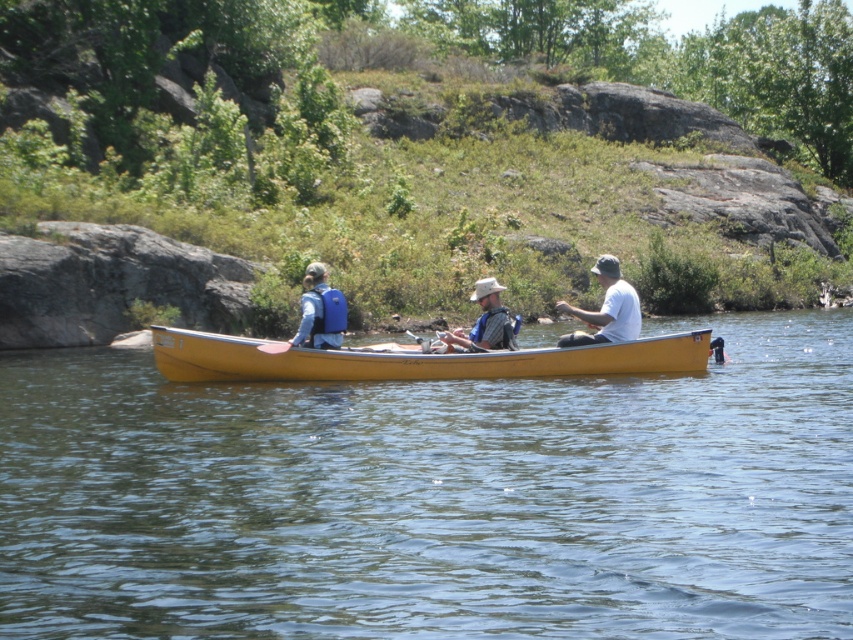
You are standing on the shore of a lake and see the yellow wood canoe at center. If you want to throw a lifebuoy to the canoe, which is 20.50 meters away, can you reach it with a throw of 20 meters?

The yellow wood canoe at center is 20.50 meters away from the camera. Since your throw can reach 20 meters, you cannot reach the yellow wood canoe at center with a throw of 20 meters.

Consider the image. You are a safety inspector checking the canoe. You notice the matte blue life vest at center and the white matte shirt at center. Which item takes up more space horizontally?

The matte blue life vest at center has a larger width than the white matte shirt at center, so it takes up more horizontal space.